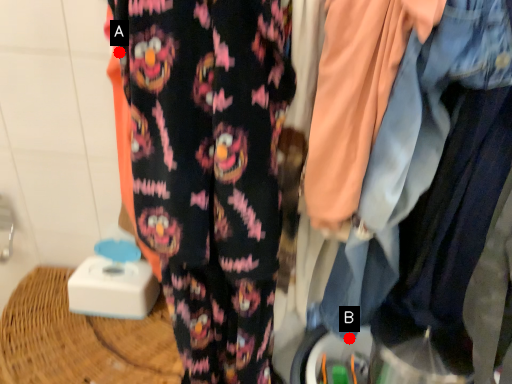
Question: Two points are circled on the image, labeled by A and B beside each circle. Which of the following is the farthest from the observer?

Choices:
 (A) A is further
 (B) B is further

Answer: (B)